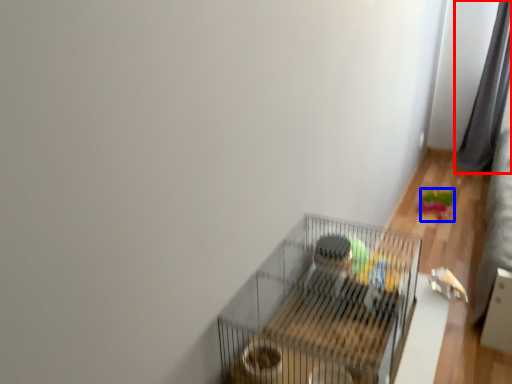
Question: Among these objects, which one is farthest to the camera, curtain (highlighted by a red box) or toy (highlighted by a blue box)?

Choices:
 (A) curtain
 (B) toy

Answer: (A)